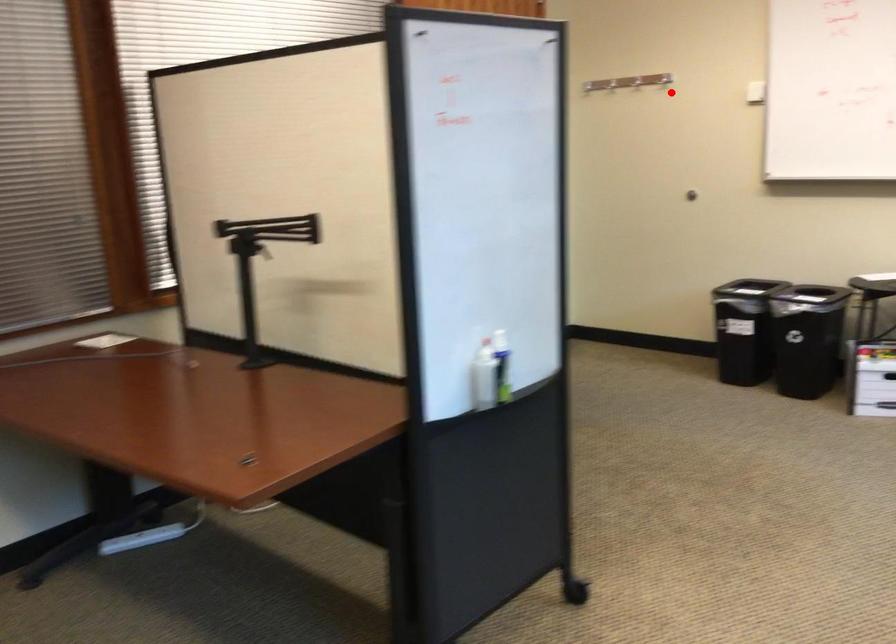
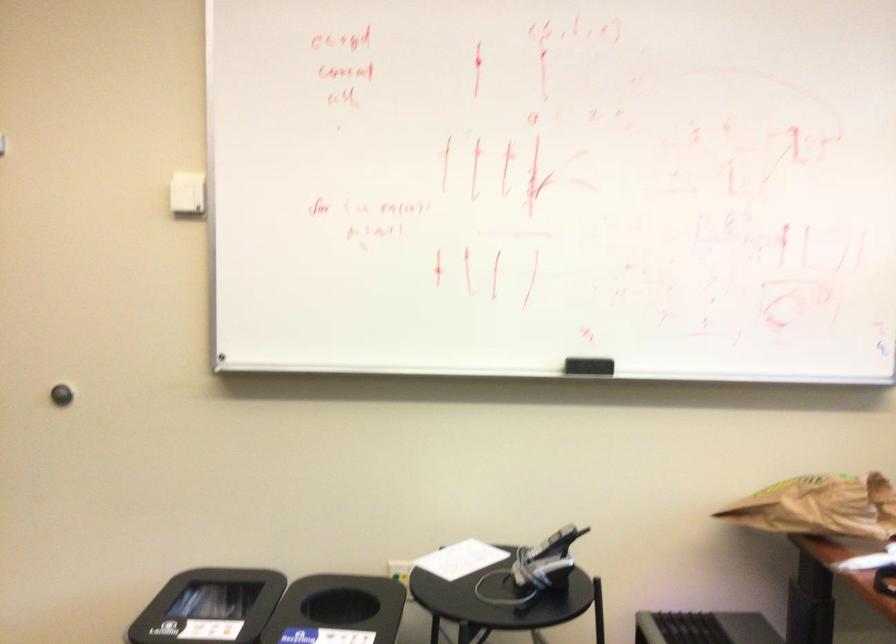
Question: I am providing you with two images of the same scene from different viewpoints. In image1, a red point is highlighted. Considering the same 3D point in image2, which of the following is correct?

Choices:
 (A) It is closer
 (B) It is farther

Answer: (A)